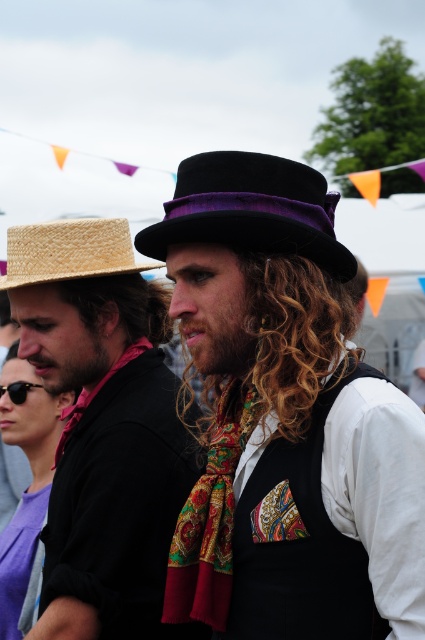
Is point (88, 536) behind point (221, 595)?

Yes.

Measure the distance between matte straw hat at left and camera.

matte straw hat at left and camera are 3.52 meters apart from each other.

Does point (153, 336) come behind point (371, 627)?

Yes, point (153, 336) is behind point (371, 627).

Image resolution: width=425 pixels, height=640 pixels. I want to click on matte straw hat at left, so click(x=102, y=428).

Does point (190, 342) come farther from viewer compared to point (272, 237)?

Yes.

Between curly golden hair at center and velvet black fedora at center, which one is positioned higher?

velvet black fedora at center is above.

Locate an element on the screen. The image size is (425, 640). curly golden hair at center is located at coordinates (261, 324).

Identify the location of matte straw hat at left. This screenshot has width=425, height=640. (102, 428).

Based on the photo, does matte straw hat at left lie in front of curly golden hair at center?

No, matte straw hat at left is behind curly golden hair at center.

Which is behind, point (110, 428) or point (226, 362)?

Positioned behind is point (110, 428).

Identify the location of matte straw hat at left. Image resolution: width=425 pixels, height=640 pixels. (102, 428).